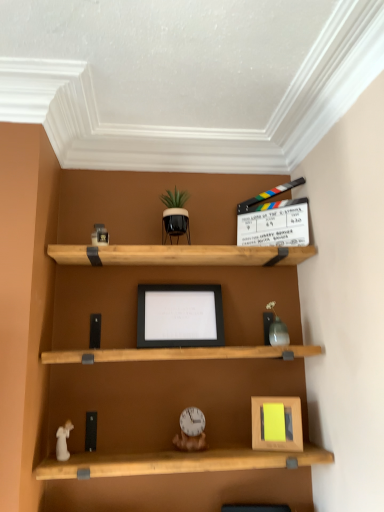
Question: From a real-world perspective, is black matte picture frame at center, the 2th picture frame viewed from the right, physically above matte gray vase at upper right, the first toy viewed from the right?

Choices:
 (A) no
 (B) yes

Answer: (B)

Question: Does black matte picture frame at center, which is the 1th picture frame in top-to-bottom order, appear on the right side of matte gray vase at upper right, acting as the fourth toy starting from the left?

Choices:
 (A) no
 (B) yes

Answer: (A)

Question: Is the depth of black matte picture frame at center, which is the 1th picture frame in top-to-bottom order, less than that of matte gray vase at upper right, the 3th toy ordered from the bottom?

Choices:
 (A) no
 (B) yes

Answer: (A)

Question: Is black matte picture frame at center, the 2th picture frame viewed from the front, completely or partially outside of matte gray vase at upper right, the first toy viewed from the right?

Choices:
 (A) no
 (B) yes

Answer: (B)

Question: Is black matte picture frame at center, placed as the second picture frame when sorted from bottom to top, facing towards matte gray vase at upper right, the second toy from the top?

Choices:
 (A) no
 (B) yes

Answer: (A)

Question: Choose the correct answer: Is white porcelain angel at lower left, marked as the 2th toy in a bottom-to-top arrangement, inside wooden picture frame at lower right, which is counted as the 2th picture frame, starting from the top, or outside it?

Choices:
 (A) outside
 (B) inside

Answer: (A)

Question: Considering the positions of white porcelain angel at lower left, the first toy in the left-to-right sequence, and wooden picture frame at lower right, which appears as the 1th picture frame when viewed from the right, in the image, is white porcelain angel at lower left, the first toy in the left-to-right sequence, taller or shorter than wooden picture frame at lower right, which appears as the 1th picture frame when viewed from the right,?

Choices:
 (A) tall
 (B) short

Answer: (B)

Question: From a real-world perspective, is white porcelain angel at lower left, marked as the 2th toy in a bottom-to-top arrangement, above or below wooden picture frame at lower right, which appears as the second picture frame when viewed from the back?

Choices:
 (A) below
 (B) above

Answer: (A)

Question: Is white porcelain angel at lower left, positioned as the 4th toy in right-to-left order, in front of or behind wooden picture frame at lower right, which appears as the 1th picture frame when viewed from the right, in the image?

Choices:
 (A) front
 (B) behind

Answer: (A)

Question: In terms of size, does white porcelain angel at lower left, positioned as the 4th toy in right-to-left order, appear bigger or smaller than wooden clock at center, which ranks as the first toy in bottom-to-top order?

Choices:
 (A) big
 (B) small

Answer: (B)

Question: From the image's perspective, is white porcelain angel at lower left, marked as the 2th toy in a bottom-to-top arrangement, located above or below wooden clock at center, the second toy viewed from the right?

Choices:
 (A) above
 (B) below

Answer: (A)

Question: Is white porcelain angel at lower left, the first toy in the left-to-right sequence, taller or shorter than wooden clock at center, arranged as the fourth toy when viewed from the top?

Choices:
 (A) short
 (B) tall

Answer: (A)

Question: Is white porcelain angel at lower left, which is counted as the 3th toy, starting from the top, in front of or behind wooden clock at center, arranged as the fourth toy when viewed from the top, in the image?

Choices:
 (A) front
 (B) behind

Answer: (A)

Question: Looking at their shapes, would you say matte gray vase at upper right, the first toy viewed from the right, is wider or thinner than wooden picture frame at lower right, placed as the 2th picture frame when sorted from left to right?

Choices:
 (A) wide
 (B) thin

Answer: (A)

Question: Is matte gray vase at upper right, the second toy from the top, taller or shorter than wooden picture frame at lower right, which appears as the second picture frame when viewed from the back?

Choices:
 (A) tall
 (B) short

Answer: (B)